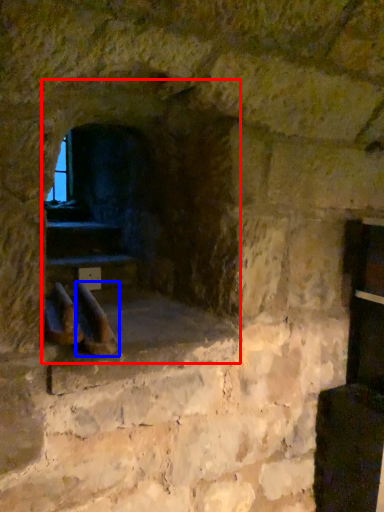
Question: Which object is further to the camera taking this photo, fireplace (highlighted by a red box) or footwear (highlighted by a blue box)?

Choices:
 (A) fireplace
 (B) footwear

Answer: (A)